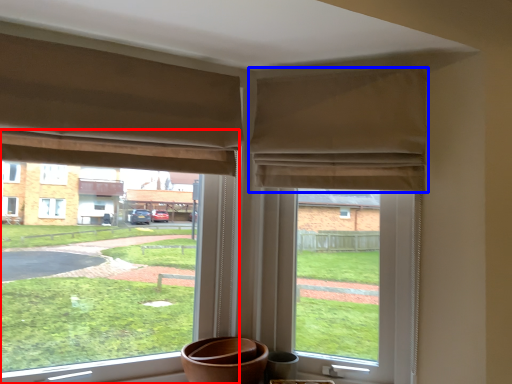
Question: Among these objects, which one is farthest to the camera, window (highlighted by a red box) or curtain (highlighted by a blue box)?

Choices:
 (A) window
 (B) curtain

Answer: (B)